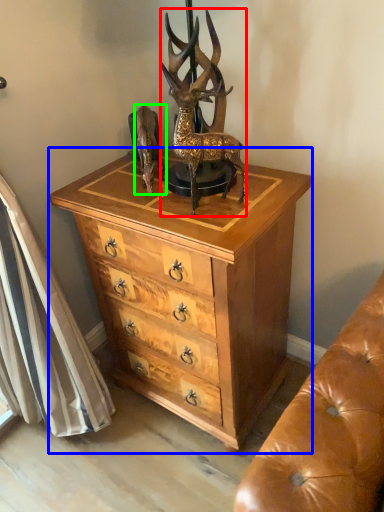
Question: Considering the real-world distances, which object is farthest from deer (highlighted by a red box)? chest of drawers (highlighted by a blue box) or animal (highlighted by a green box)?

Choices:
 (A) chest of drawers
 (B) animal

Answer: (A)